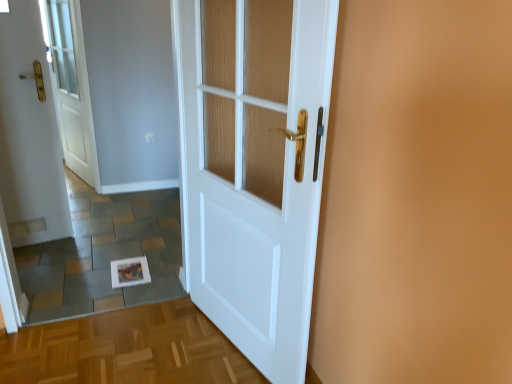
What are the coordinates of `white wood door at center, which appears as the 2th door when viewed from the back` in the screenshot? It's located at (254, 167).

Describe the element at coordinates (254, 167) in the screenshot. I see `white wood door at center, the second door viewed from the left` at that location.

Locate an element on the screen. The width and height of the screenshot is (512, 384). white glossy door at left, the first door viewed from the left is located at coordinates (29, 134).

What do you see at coordinates (29, 134) in the screenshot?
I see `white glossy door at left, the first door viewed from the left` at bounding box center [29, 134].

Measure the distance between white glossy door at left, arranged as the second door when viewed from the front, and camera.

A distance of 2.28 meters exists between white glossy door at left, arranged as the second door when viewed from the front, and camera.

What is the approximate height of white glossy door at left, the first door viewed from the left?

It is 4.92 feet.

What is the approximate width of white glossy door at left, arranged as the 1th door when viewed from the back?

white glossy door at left, arranged as the 1th door when viewed from the back, is 1.63 inches in width.

You are a GUI agent. You are given a task and a screenshot of the screen. Output one action in this format:
    pyautogui.click(x=<x>, y=<y>)
    Task: Click on the white wood door at center, the second door viewed from the left
    The height and width of the screenshot is (384, 512).
    Given the screenshot: What is the action you would take?
    pyautogui.click(x=254, y=167)

Which is more to the right, white glossy door at left, the second door in the right-to-left sequence, or white wood door at center, which appears as the 1th door when viewed from the front?

Positioned to the right is white wood door at center, which appears as the 1th door when viewed from the front.

In the image, is white glossy door at left, arranged as the second door when viewed from the front, positioned in front of or behind white wood door at center, positioned as the first door in right-to-left order?

white glossy door at left, arranged as the second door when viewed from the front, is positioned farther from the viewer than white wood door at center, positioned as the first door in right-to-left order.

Is point (38, 235) behind point (188, 235)?

That is True.

From the image's perspective, between white glossy door at left, the second door in the right-to-left sequence, and white wood door at center, the second door viewed from the left, which one is located above?

white glossy door at left, the second door in the right-to-left sequence, appears higher in the image.

From a real-world perspective, between white glossy door at left, arranged as the second door when viewed from the front, and white wood door at center, positioned as the first door in right-to-left order, who is vertically higher?

From a 3D spatial view, white glossy door at left, arranged as the second door when viewed from the front, is above.

Is white glossy door at left, arranged as the second door when viewed from the front, thinner than white wood door at center, which appears as the 1th door when viewed from the front?

Correct, the width of white glossy door at left, arranged as the second door when viewed from the front, is less than that of white wood door at center, which appears as the 1th door when viewed from the front.

Who is taller, white glossy door at left, the second door in the right-to-left sequence, or white wood door at center, which appears as the 2th door when viewed from the back?

Standing taller between the two is white glossy door at left, the second door in the right-to-left sequence.

Looking at the image, does white glossy door at left, arranged as the second door when viewed from the front, seem bigger or smaller compared to white wood door at center, positioned as the first door in right-to-left order?

Clearly, white glossy door at left, arranged as the second door when viewed from the front, is smaller in size than white wood door at center, positioned as the first door in right-to-left order.

Choose the correct answer: Is white glossy door at left, arranged as the second door when viewed from the front, inside white wood door at center, which appears as the 1th door when viewed from the front, or outside it?

white glossy door at left, arranged as the second door when viewed from the front, is located beyond the bounds of white wood door at center, which appears as the 1th door when viewed from the front.

Is white glossy door at left, the first door viewed from the left, positioned far away from white wood door at center, which appears as the 2th door when viewed from the back?

white glossy door at left, the first door viewed from the left, is positioned a significant distance from white wood door at center, which appears as the 2th door when viewed from the back.

Is white glossy door at left, arranged as the second door when viewed from the front, oriented towards white wood door at center, positioned as the first door in right-to-left order?

No.

Find the location of `door above the white wood door at center, positioned as the first door in right-to-left order (from the image's perspective)`. door above the white wood door at center, positioned as the first door in right-to-left order (from the image's perspective) is located at coordinates (29, 134).

Considering the positions of objects white wood door at center, the second door viewed from the left, and white glossy door at left, the second door in the right-to-left sequence, in the image provided, who is more to the right, white wood door at center, the second door viewed from the left, or white glossy door at left, the second door in the right-to-left sequence,?

white wood door at center, the second door viewed from the left.

Considering the relative positions of white wood door at center, which appears as the 1th door when viewed from the front, and white glossy door at left, the second door in the right-to-left sequence, in the image provided, is white wood door at center, which appears as the 1th door when viewed from the front, behind white glossy door at left, the second door in the right-to-left sequence,?

No, the depth of white wood door at center, which appears as the 1th door when viewed from the front, is less than that of white glossy door at left, the second door in the right-to-left sequence.

Considering the positions of point (311, 234) and point (0, 44), is point (311, 234) closer or farther from the camera than point (0, 44)?

Point (311, 234) is closer to the camera than point (0, 44).

From the image's perspective, is white wood door at center, which appears as the 2th door when viewed from the back, beneath white glossy door at left, the first door viewed from the left?

Yes.

From a real-world perspective, is white wood door at center, which appears as the 1th door when viewed from the front, physically below white glossy door at left, the second door in the right-to-left sequence?

Yes, from a real-world perspective, white wood door at center, which appears as the 1th door when viewed from the front, is beneath white glossy door at left, the second door in the right-to-left sequence.

Is white wood door at center, the second door viewed from the left, thinner than white glossy door at left, arranged as the second door when viewed from the front?

In fact, white wood door at center, the second door viewed from the left, might be wider than white glossy door at left, arranged as the second door when viewed from the front.

Who is taller, white wood door at center, positioned as the first door in right-to-left order, or white glossy door at left, the first door viewed from the left?

white glossy door at left, the first door viewed from the left.

Which of these two, white wood door at center, which appears as the 2th door when viewed from the back, or white glossy door at left, the first door viewed from the left, is bigger?

With larger size is white wood door at center, which appears as the 2th door when viewed from the back.

Is white wood door at center, which appears as the 2th door when viewed from the back, not inside white glossy door at left, the second door in the right-to-left sequence?

Absolutely, white wood door at center, which appears as the 2th door when viewed from the back, is external to white glossy door at left, the second door in the right-to-left sequence.

Is there a large distance between white wood door at center, which appears as the 2th door when viewed from the back, and white glossy door at left, the first door viewed from the left?

white wood door at center, which appears as the 2th door when viewed from the back, is far away from white glossy door at left, the first door viewed from the left.

In the scene shown: Does white wood door at center, the second door viewed from the left, turn towards white glossy door at left, arranged as the second door when viewed from the front?

No, white wood door at center, the second door viewed from the left, is not oriented towards white glossy door at left, arranged as the second door when viewed from the front.

How many degrees apart are the facing directions of white wood door at center, which appears as the 1th door when viewed from the front, and white glossy door at left, the second door in the right-to-left sequence?

74.3 degrees.

From the picture: Could you measure the distance between white wood door at center, the second door viewed from the left, and white glossy door at left, arranged as the second door when viewed from the front?

They are 4.60 feet apart.

Locate an element on the screen. door above the white wood door at center, which appears as the 1th door when viewed from the front (from the image's perspective) is located at coordinates (29, 134).

Locate an element on the screen. The height and width of the screenshot is (384, 512). door below the white glossy door at left, arranged as the 1th door when viewed from the back (from a real-world perspective) is located at coordinates (254, 167).

Image resolution: width=512 pixels, height=384 pixels. What are the coordinates of `door above the white wood door at center, the second door viewed from the left (from a real-world perspective)` in the screenshot? It's located at (29, 134).